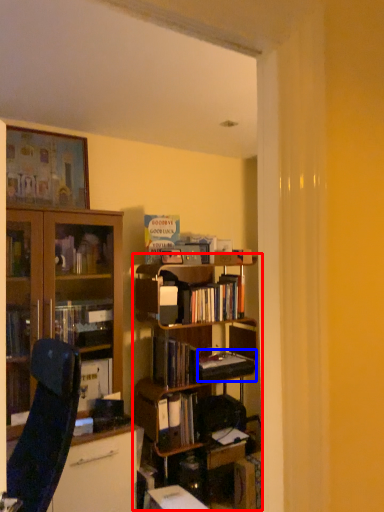
Question: Which object is closer to the camera taking this photo, bookcase (highlighted by a red box) or paperback book (highlighted by a blue box)?

Choices:
 (A) bookcase
 (B) paperback book

Answer: (A)